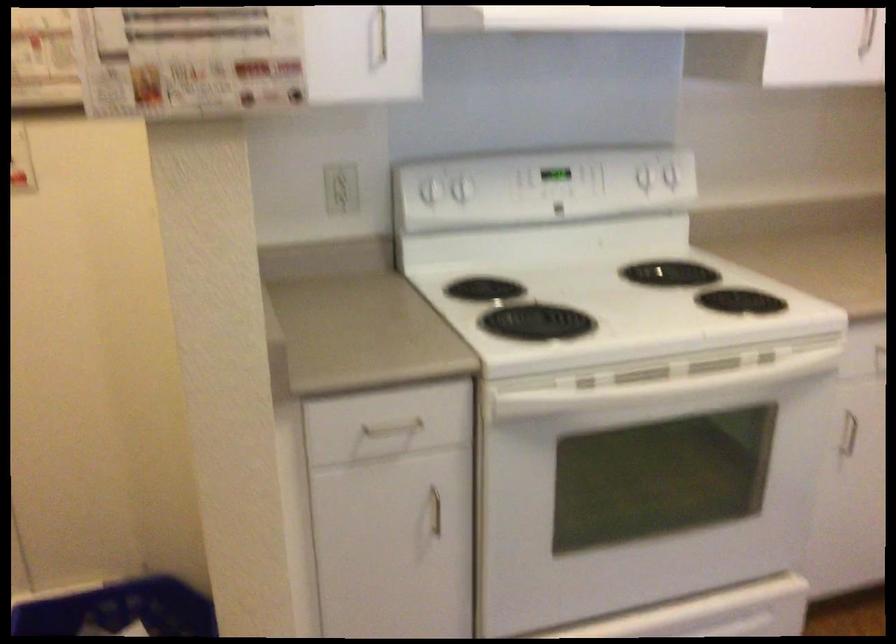
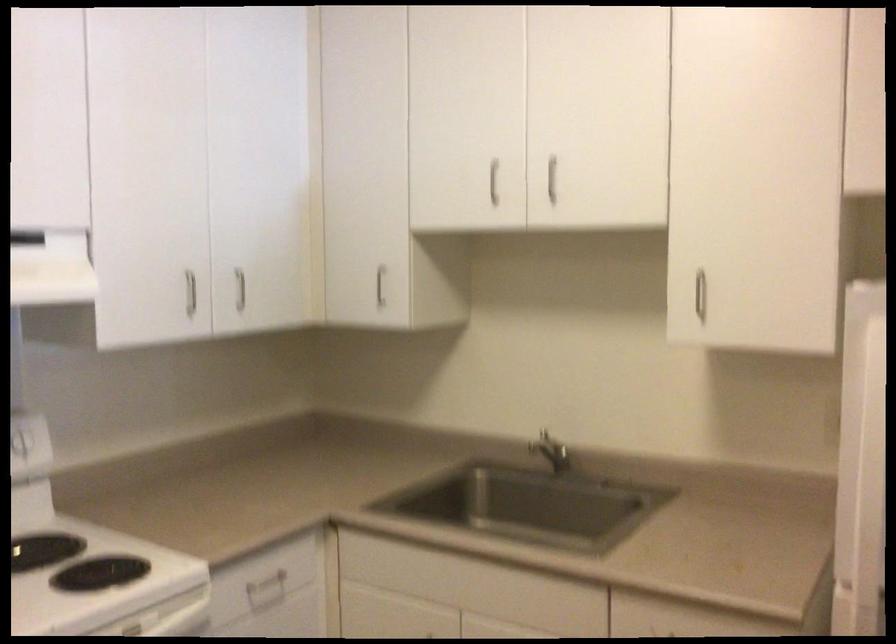
Question: The camera is either moving clockwise (left) or counter-clockwise (right) around the object. The first image is from the beginning of the video and the second image is from the end. Is the camera moving left or right when shooting the video?

Choices:
 (A) Left
 (B) Right

Answer: (A)